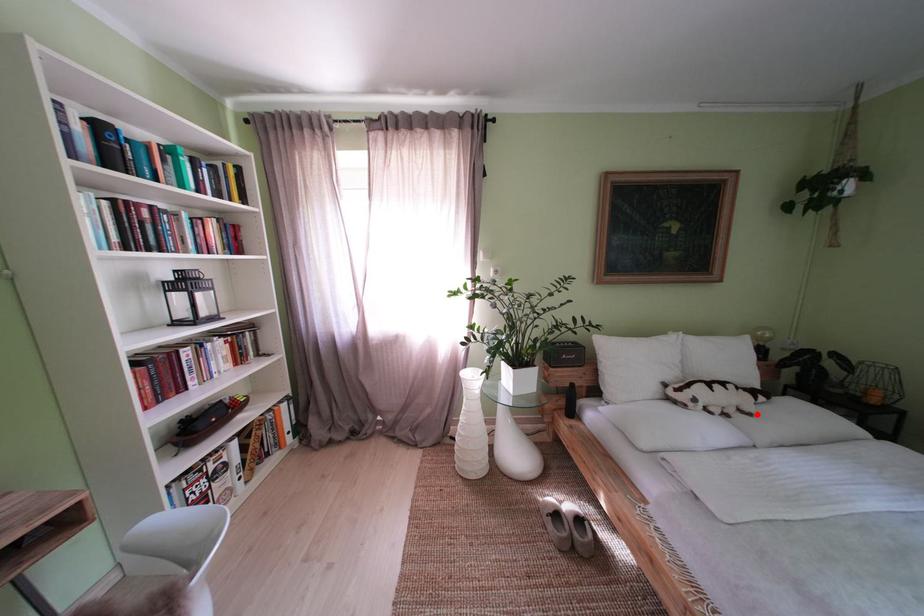
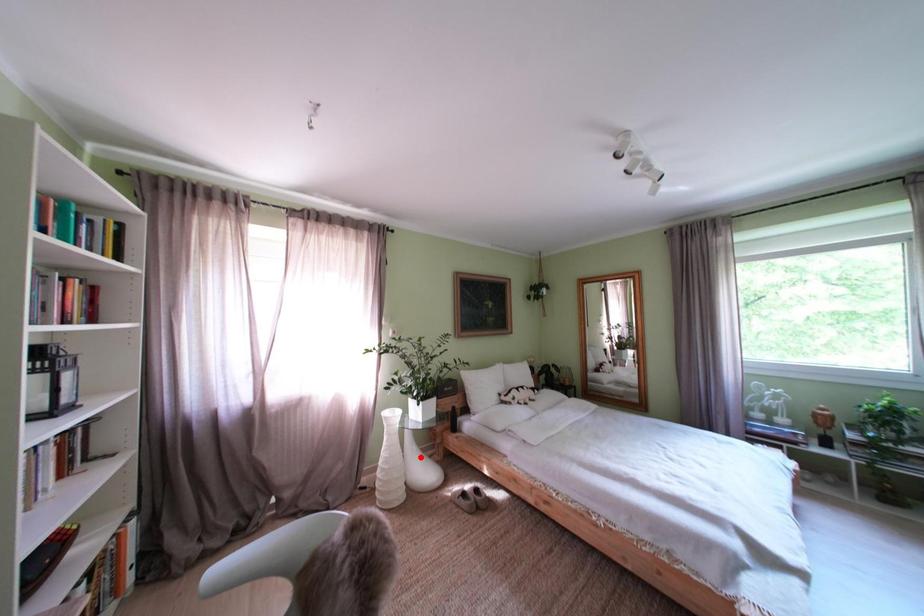
I am providing you with two images of the same scene from different viewpoints. A red point is marked on the first image and another point is marked on the second image. Is the red point in image1 aligned with the point shown in image2?

No